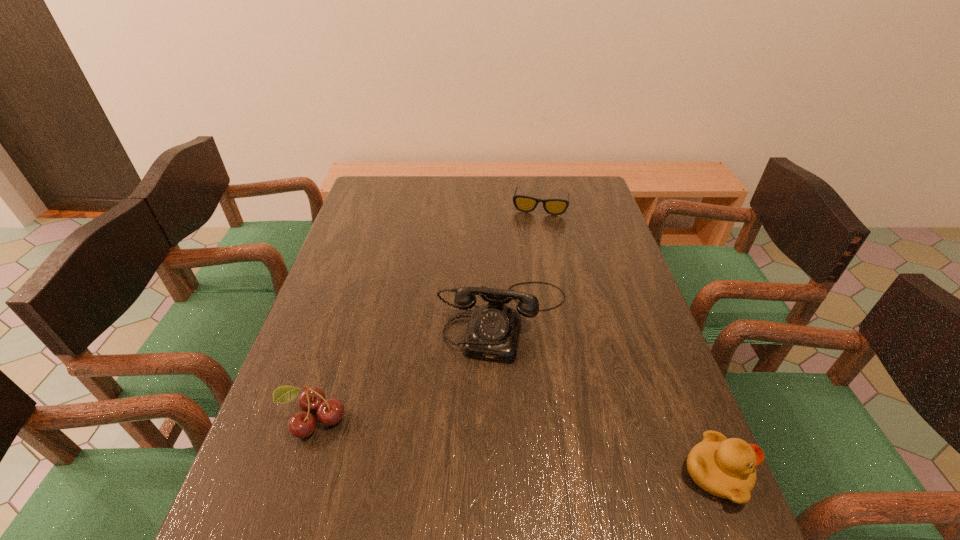
Where is `free spot on the desktop that is between the leftmost object and the rightmost object and is positioned on the front-facing side of the telephone`? free spot on the desktop that is between the leftmost object and the rightmost object and is positioned on the front-facing side of the telephone is located at coordinates (482, 442).

You are a GUI agent. You are given a task and a screenshot of the screen. Output one action in this format:
    pyautogui.click(x=<x>, y=<y>)
    Task: Click on the vacant space on the desktop that is between the leftmost object and the rightmost object and is positioned on the front-facing side of the farthest object
    Image resolution: width=960 pixels, height=540 pixels.
    Given the screenshot: What is the action you would take?
    pyautogui.click(x=499, y=445)